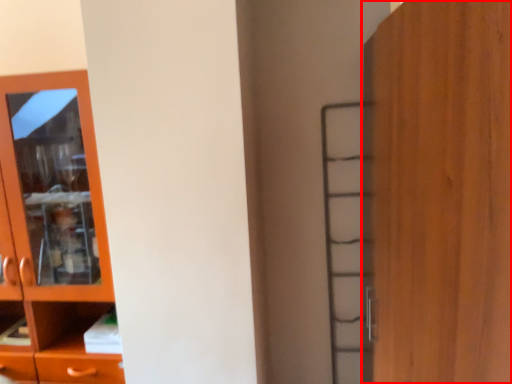
Question: From the image's perspective, what is the correct spatial relationship of door (annotated by the red box) in relation to cupboard?

Choices:
 (A) above
 (B) below

Answer: (B)